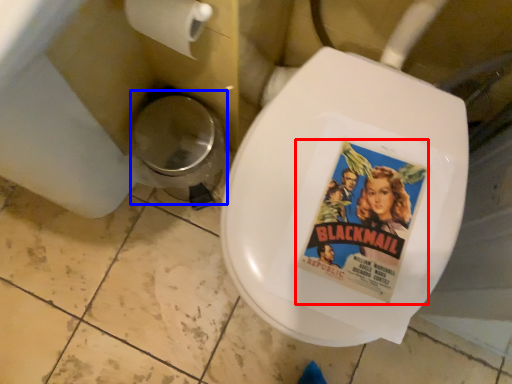
Question: Which point is further to the camera, movie poster (highlighted by a red box) or potty (highlighted by a blue box)?

Choices:
 (A) movie poster
 (B) potty

Answer: (B)